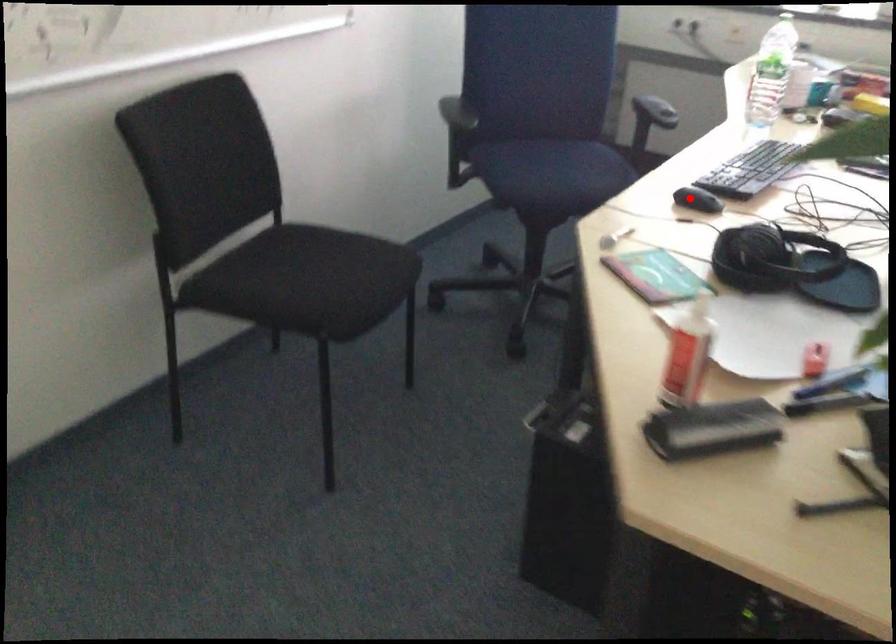
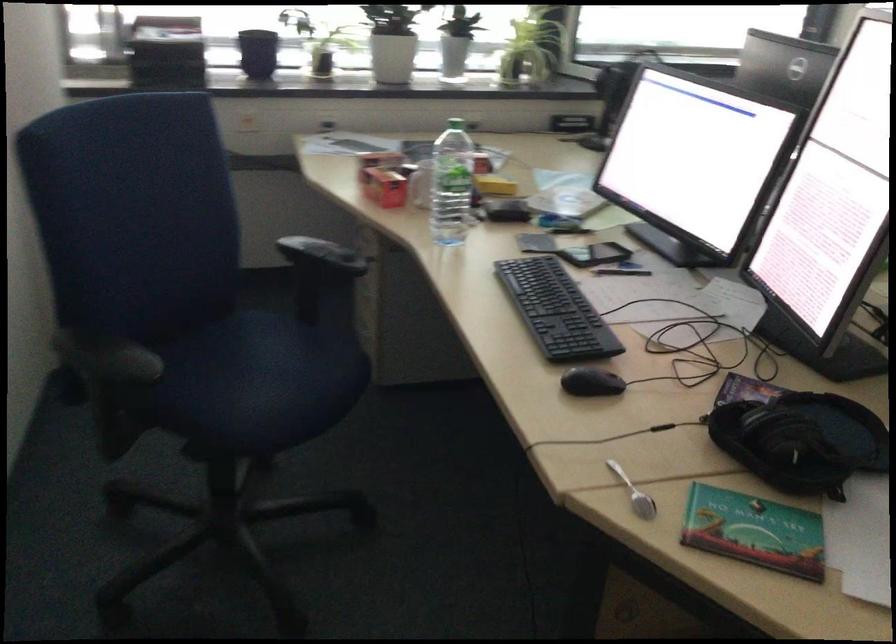
Where in the second image is the point corresponding to the highlighted location from the first image?

(590, 382)